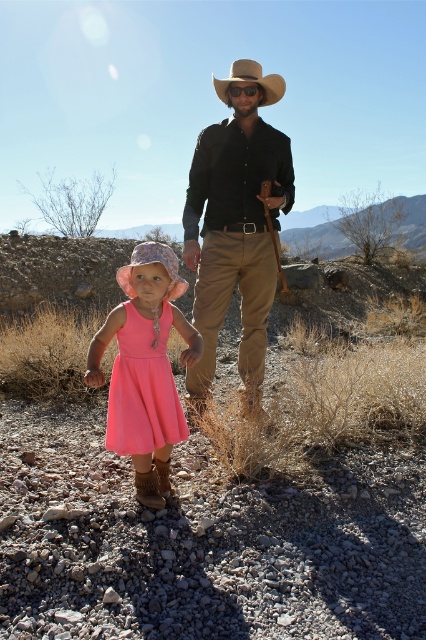
Does pink fabric dress at center have a larger size compared to brown felt cowboy hat at center?

No.

Is point (164, 353) positioned after point (221, 96)?

No, (164, 353) is in front of (221, 96).

At what (x,y) coordinates should I click in order to perform the action: click on pink fabric dress at center. Please return your answer as a coordinate pair (x, y). Looking at the image, I should click on (144, 369).

Is point (267, 291) positioned in front of point (143, 294)?

No, it is behind (143, 294).

Is matte black shirt at center thinner than pink fabric dress at center?

In fact, matte black shirt at center might be wider than pink fabric dress at center.

Is point (247, 81) more distant than point (120, 348)?

That is True.

Find the location of a particular element. matte black shirt at center is located at coordinates (236, 221).

Between pink fabric dress at center and pink fabric dress at lower left, which one has more height?

Standing taller between the two is pink fabric dress at center.

Does point (126, 337) come farther from viewer compared to point (129, 380)?

That is False.

Image resolution: width=426 pixels, height=640 pixels. I want to click on pink fabric dress at center, so click(144, 369).